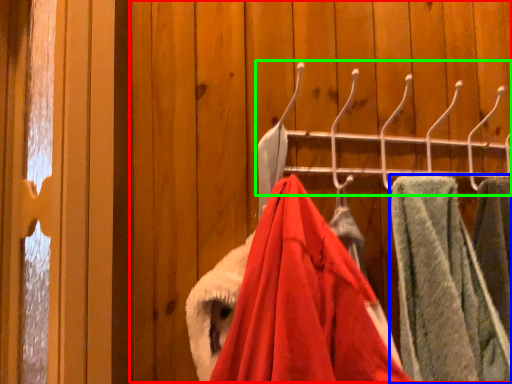
Question: Considering the real-world distances, which object is closest to closet (highlighted by a red box)? towel (highlighted by a blue box) or closet (highlighted by a green box).

Choices:
 (A) towel
 (B) closet

Answer: (B)